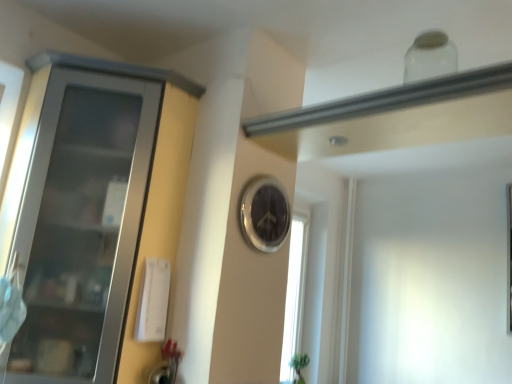
Question: Does metallic silver clock at center have a smaller size compared to matte gray cabinet at left?

Choices:
 (A) no
 (B) yes

Answer: (B)

Question: Can you confirm if metallic silver clock at center is thinner than matte gray cabinet at left?

Choices:
 (A) no
 (B) yes

Answer: (B)

Question: Considering the relative positions of metallic silver clock at center and matte gray cabinet at left in the image provided, is metallic silver clock at center behind matte gray cabinet at left?

Choices:
 (A) yes
 (B) no

Answer: (A)

Question: From the image's perspective, does metallic silver clock at center appear higher than matte gray cabinet at left?

Choices:
 (A) no
 (B) yes

Answer: (B)

Question: Can you confirm if metallic silver clock at center is taller than matte gray cabinet at left?

Choices:
 (A) yes
 (B) no

Answer: (B)

Question: Would you say matte gray cabinet at left is part of metallic silver clock at center's contents?

Choices:
 (A) yes
 (B) no

Answer: (B)

Question: From the image's perspective, is matte gray cabinet at left on metallic silver clock at center?

Choices:
 (A) no
 (B) yes

Answer: (A)

Question: Is matte gray cabinet at left to the left of metallic silver clock at center from the viewer's perspective?

Choices:
 (A) yes
 (B) no

Answer: (A)

Question: Can you confirm if matte gray cabinet at left is smaller than metallic silver clock at center?

Choices:
 (A) yes
 (B) no

Answer: (B)

Question: From a real-world perspective, is matte gray cabinet at left beneath metallic silver clock at center?

Choices:
 (A) no
 (B) yes

Answer: (B)

Question: From a real-world perspective, is matte gray cabinet at left on metallic silver clock at center?

Choices:
 (A) no
 (B) yes

Answer: (A)

Question: Is matte gray cabinet at left not near metallic silver clock at center?

Choices:
 (A) yes
 (B) no

Answer: (B)

Question: Is point (258, 231) closer or farther from the camera than point (165, 314)?

Choices:
 (A) farther
 (B) closer

Answer: (A)